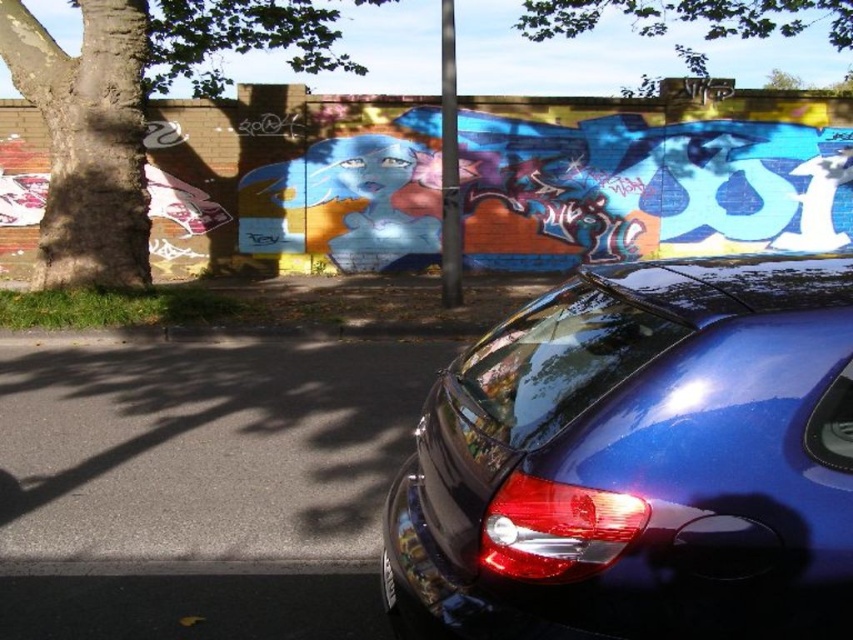
You are a delivery person who needs to park your vehicle in this area. The parking spot is narrow and only allows vehicles that are shorter than the black plastic license plate at lower center. Can your glossy blue car at lower right fit into this parking spot?

The glossy blue car at lower right is taller than the black plastic license plate at lower center. Since the parking spot requires vehicles shorter than the license plate, the glossy blue car at lower right cannot fit into this parking spot.